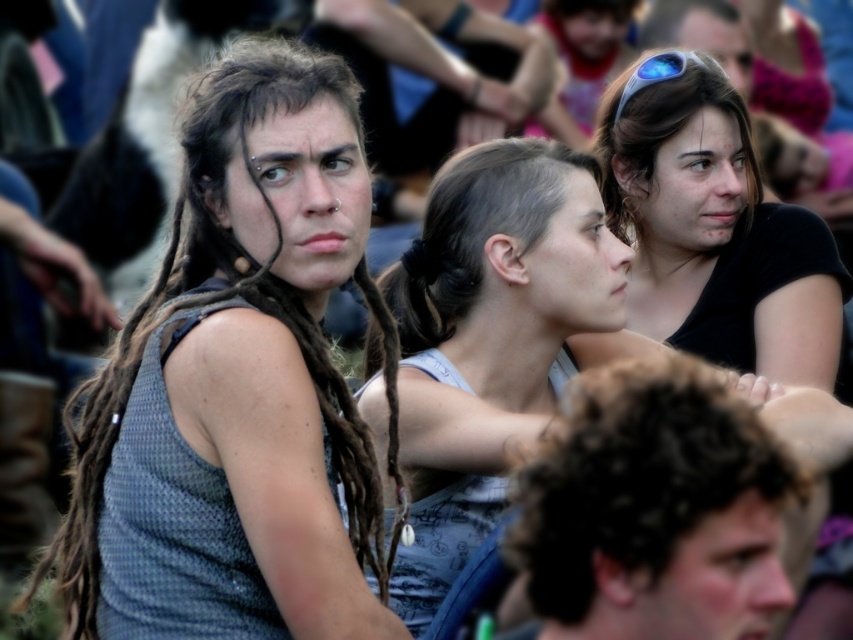
Question: In this image, where is smooth skin face at center located relative to matte skin face at upper center?

Choices:
 (A) left
 (B) right

Answer: (A)

Question: Can you confirm if dark curly hair at lower right is smaller than smooth skin face at upper right?

Choices:
 (A) yes
 (B) no

Answer: (B)

Question: Estimate the real-world distances between objects in this image. Which object is closer to the matte hair at center?

Choices:
 (A) black matte shirt at upper right
 (B) smooth skin face at lower right
 (C) smooth skin face at upper center
 (D) matte skin face at upper center

Answer: (B)

Question: Which point is closer to the camera?

Choices:
 (A) (340, 202)
 (B) (740, 28)
 (C) (680, 566)
 (D) (671, 241)

Answer: (C)

Question: Does gray textured tank top at left appear over smooth skin face at lower right?

Choices:
 (A) yes
 (B) no

Answer: (A)

Question: Which point is closer to the camera?

Choices:
 (A) matte skin face at upper center
 (B) gray textured tank top at left

Answer: (B)